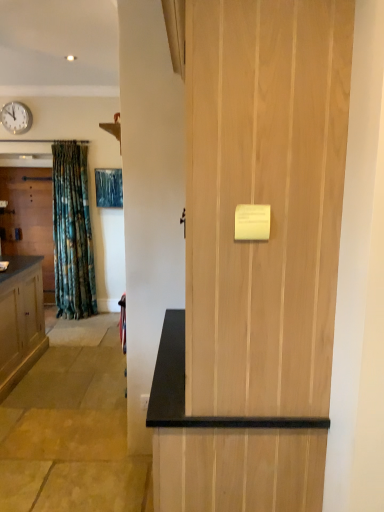
Question: Looking at the image, does white plastic clock at upper left seem bigger or smaller compared to matte wood door at left, which ranks as the 1th door in back-to-front order?

Choices:
 (A) small
 (B) big

Answer: (A)

Question: Does point (1, 112) appear closer or farther from the camera than point (44, 215)?

Choices:
 (A) closer
 (B) farther

Answer: (A)

Question: Which object is positioned farthest from the natural wood door at center, the second door when ordered from left to right?

Choices:
 (A) white plastic clock at upper left
 (B) matte wood door at left, which ranks as the 1th door in back-to-front order

Answer: (A)

Question: Estimate the real-world distances between objects in this image. Which object is farther from the white plastic clock at upper left?

Choices:
 (A) natural wood door at center, the first door when ordered from right to left
 (B) matte wood door at left, which ranks as the first door in left-to-right order

Answer: (A)